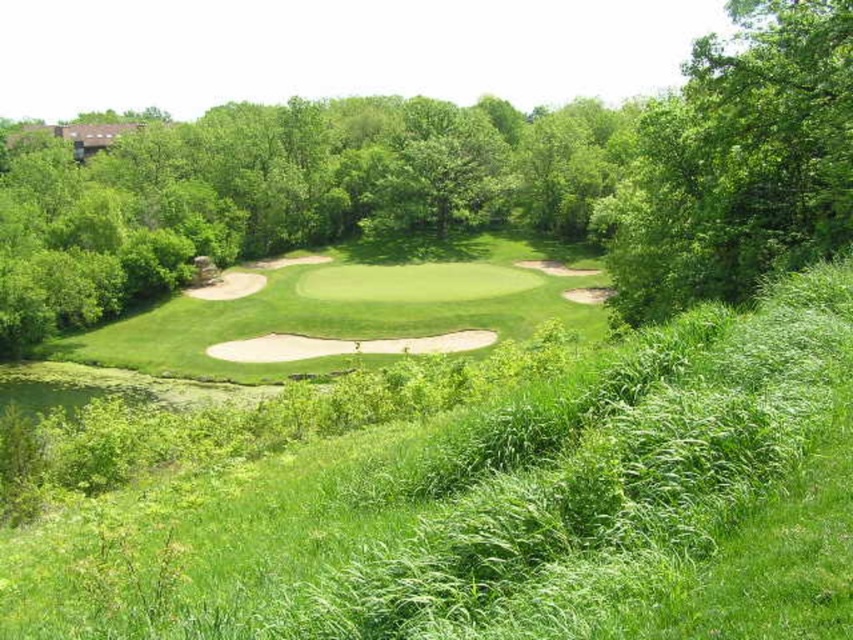
Question: Is green leafy tree at center below green leafy tree at upper right?

Choices:
 (A) no
 (B) yes

Answer: (A)

Question: Which point is closer to the camera?

Choices:
 (A) green leafy tree at upper right
 (B) green leafy tree at center

Answer: (A)

Question: Which of the following is the closest to the observer?

Choices:
 (A) (846, 301)
 (B) (668, 208)
 (C) (828, 106)

Answer: (A)

Question: Can you confirm if green leafy tree at center is bigger than green leafy tree at upper right?

Choices:
 (A) no
 (B) yes

Answer: (B)

Question: Which point is closer to the camera?

Choices:
 (A) green leafy tree at upper right
 (B) green grassy golf course at center

Answer: (B)

Question: Does green leafy tree at center have a lesser width compared to green leafy tree at upper right?

Choices:
 (A) no
 (B) yes

Answer: (A)